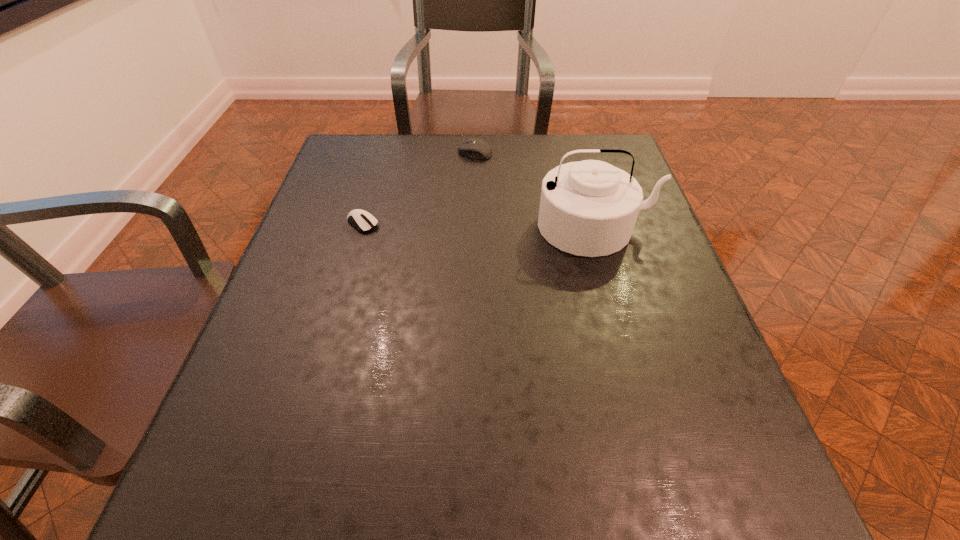
Locate an element on the screen. the tallest object is located at coordinates (589, 208).

Find the location of a particular element. The image size is (960, 540). kettle is located at coordinates (589, 208).

You are a GUI agent. You are given a task and a screenshot of the screen. Output one action in this format:
    pyautogui.click(x=<x>, y=<y>)
    Task: Click on the right mouse
    The height and width of the screenshot is (540, 960).
    Given the screenshot: What is the action you would take?
    pyautogui.click(x=475, y=148)

The height and width of the screenshot is (540, 960). I want to click on the farthest object, so click(475, 148).

The image size is (960, 540). Identify the location of the nearer mouse. (362, 220).

Where is `the left mouse`? the left mouse is located at coordinates (362, 220).

Find the location of a particular element. The image size is (960, 540). free space located 0.330m on the spout of the rightmost object is located at coordinates (646, 404).

Image resolution: width=960 pixels, height=540 pixels. In order to click on vacant space located 0.380m on the front of the right mouse in this screenshot , I will do `click(473, 258)`.

At what (x,y) coordinates should I click in order to perform the action: click on free region located on the front of the left mouse. Please return your answer as a coordinate pair (x, y). The image size is (960, 540). Looking at the image, I should click on (328, 342).

Where is `object that is at the far edge`? object that is at the far edge is located at coordinates [475, 148].